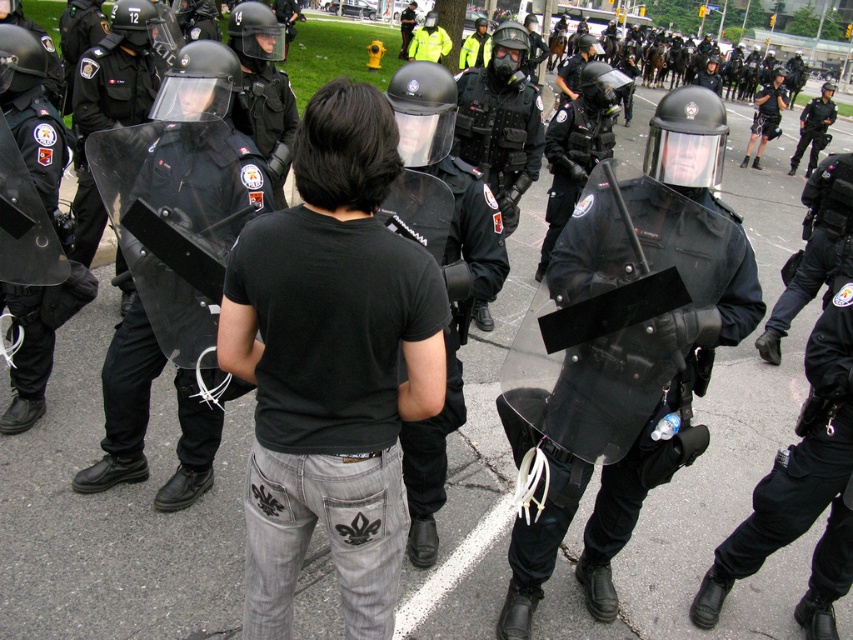
You are a photographer standing in the scene with the clear plastic shield at center. You want to take a closeup photo of the shield without moving closer than 5 feet for safety. Is the shield within your desired distance range?

The clear plastic shield at center is 7.76 feet away from the viewer. Since 7.76 feet is greater than 5 feet, the shield is within the desired distance range for taking a closeup photo without moving closer than 5 feet.

You are a photographer positioned at the camera location. You want to capture a closeup of the clear plastic shield at center without moving closer than 2 meters. Can you do it?

The clear plastic shield at center is 2.37 meters away from the camera, so yes, you can capture a closeup without moving closer than 2 meters since the distance is sufficient.